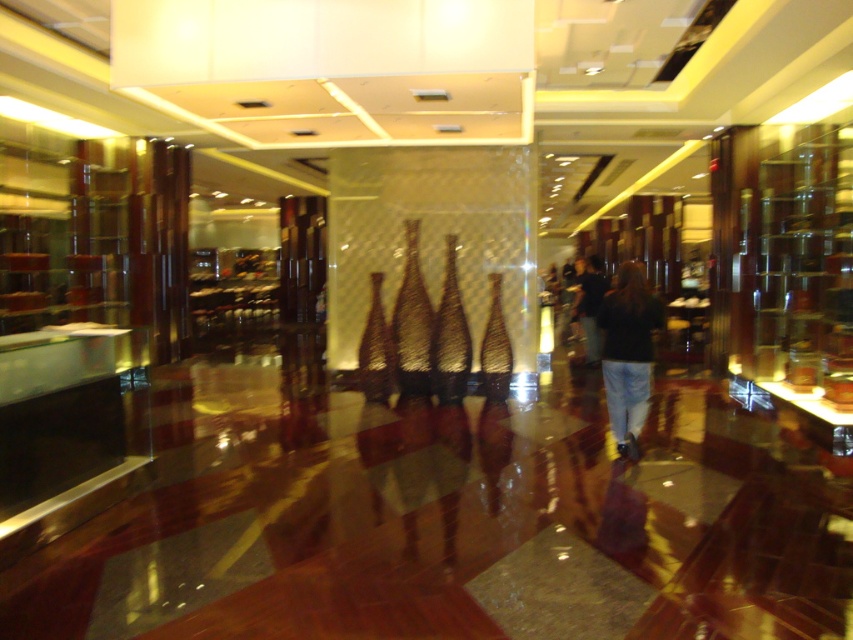
Is black denim jeans at center bigger than dark blue jeans at center?

Yes.

Who is taller, black denim jeans at center or dark blue jeans at center?

Standing taller between the two is black denim jeans at center.

The image size is (853, 640). In order to click on black denim jeans at center in this screenshot , I will do tap(628, 353).